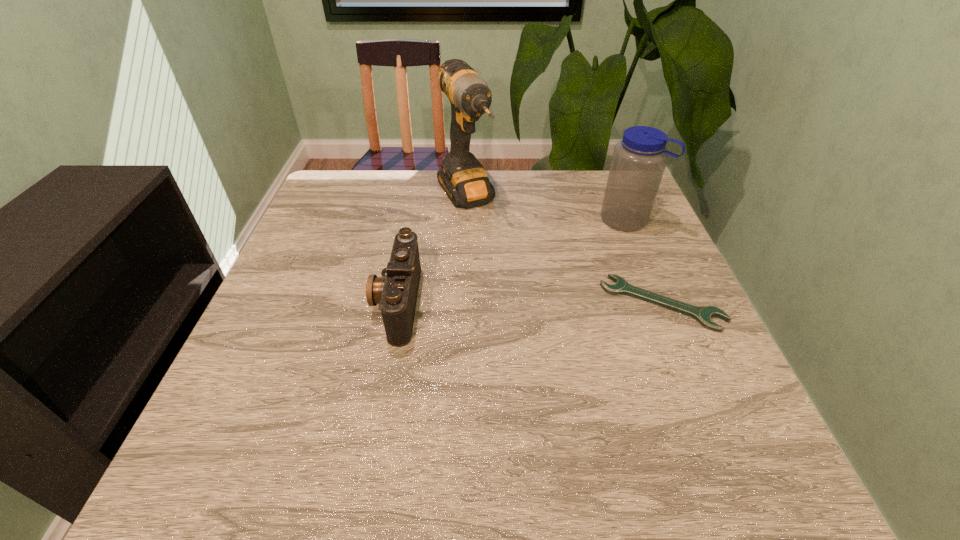
Find the location of `vacant area located with a carrying loop on the side of the third shortest object`. vacant area located with a carrying loop on the side of the third shortest object is located at coordinates (547, 281).

Where is `vacant space situated with a carrying loop on the side of the third shortest object`? Image resolution: width=960 pixels, height=540 pixels. vacant space situated with a carrying loop on the side of the third shortest object is located at coordinates click(550, 279).

Identify the location of vacant area situated with a carrying loop on the side of the third shortest object. (541, 286).

Where is `free space located with the drill bit of the tallest object facing forward`? Image resolution: width=960 pixels, height=540 pixels. free space located with the drill bit of the tallest object facing forward is located at coordinates (554, 325).

Find the location of a particular element. free space located 0.400m with the drill bit of the tallest object facing forward is located at coordinates (557, 328).

What are the coordinates of `free space located 0.290m with the drill bit of the tallest object facing forward` in the screenshot? It's located at (530, 293).

At what (x,y) coordinates should I click in order to perform the action: click on water bottle located in the far edge section of the desktop. Please return your answer as a coordinate pair (x, y). Looking at the image, I should click on (639, 160).

The height and width of the screenshot is (540, 960). I want to click on drill that is at the far edge, so click(x=463, y=178).

Identify the location of wrench positioned at the right edge. (703, 315).

The height and width of the screenshot is (540, 960). Find the location of `water bottle that is at the right edge`. water bottle that is at the right edge is located at coordinates pyautogui.click(x=639, y=160).